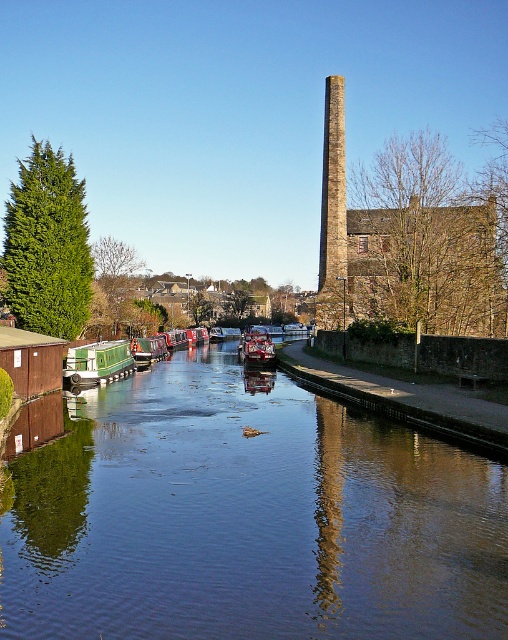
Can you confirm if rustic stone chimney at center is wider than green painted wooden canal boat at left?

Indeed, rustic stone chimney at center has a greater width compared to green painted wooden canal boat at left.

Is rustic stone chimney at center above green painted wooden canal boat at left?

Yes.

Which is in front, point (330, 314) or point (128, 346)?

Point (128, 346)

I want to click on rustic stone chimney at center, so click(333, 211).

Is rustic stone chimney at center to the left of metallic red boat at center from the viewer's perspective?

Incorrect, rustic stone chimney at center is not on the left side of metallic red boat at center.

Is rustic stone chimney at center behind metallic red boat at center?

No, rustic stone chimney at center is in front of metallic red boat at center.

You are a GUI agent. You are given a task and a screenshot of the screen. Output one action in this format:
    pyautogui.click(x=<x>, y=<y>)
    Task: Click on the rustic stone chimney at center
    
    Given the screenshot: What is the action you would take?
    pyautogui.click(x=333, y=211)

This screenshot has height=640, width=508. Identify the location of rustic stone chimney at center. (333, 211).

Between smooth dark water at center and rustic stone chimney at center, which one is positioned higher?

rustic stone chimney at center is higher up.

Between smooth dark water at center and rustic stone chimney at center, which one appears on the left side from the viewer's perspective?

smooth dark water at center

Describe the element at coordinates (244, 516) in the screenshot. Image resolution: width=508 pixels, height=640 pixels. I see `smooth dark water at center` at that location.

Locate an element on the screen. smooth dark water at center is located at coordinates (244, 516).